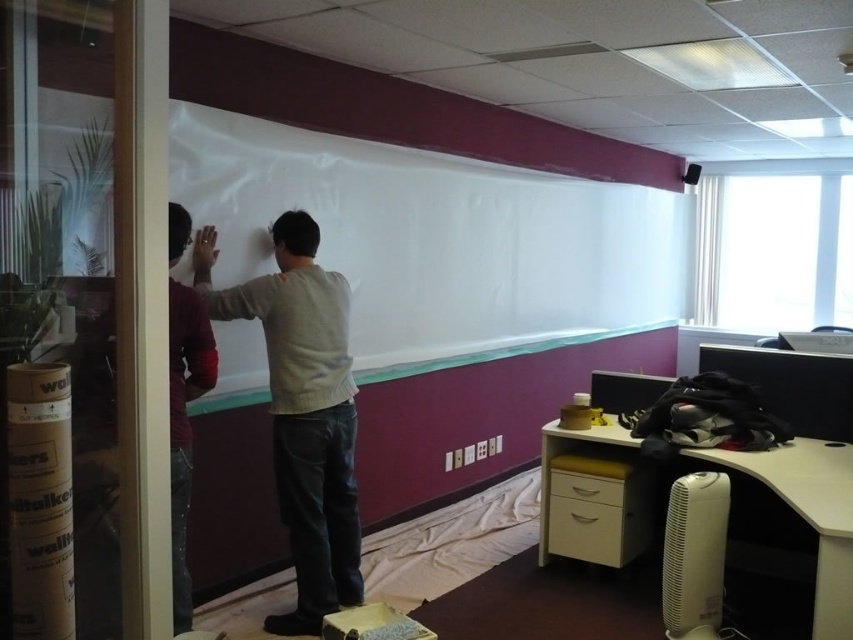
You are an interior designer assessing the office layout. You need to place a decorative item on the white matte board at center and the maroon sweater at left. Considering their sizes, which object requires a larger space for placement?

The white matte board at center requires a larger space for placement since its width is greater than the maroon sweater at left.

You are a delivery person who needs to place a package on the camera. The package is 3 meters long. Can you reach the camera from the light gray sweater at center without moving the package?

The distance between the light gray sweater at center and the camera is 2.70 meters. Since the package is 3 meters long, it is slightly longer than the distance required. Therefore, you can extend the package from the light gray sweater at center to reach the camera.